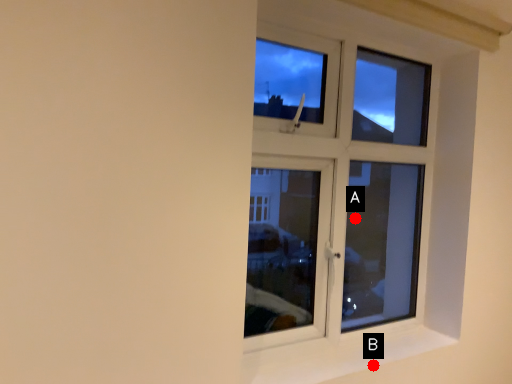
Question: Two points are circled on the image, labeled by A and B beside each circle. Which point is closer to the camera?

Choices:
 (A) A is closer
 (B) B is closer

Answer: (B)